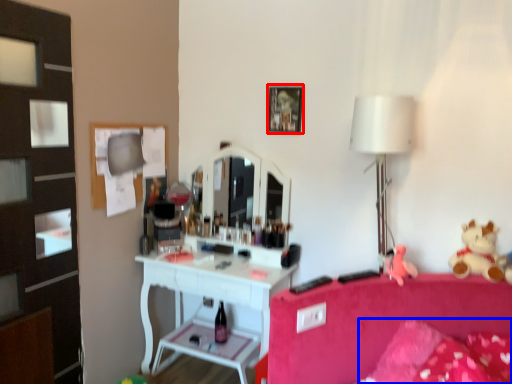
Question: Which object appears farthest to the camera in this image, picture frame (highlighted by a red box) or pillow (highlighted by a blue box)?

Choices:
 (A) picture frame
 (B) pillow

Answer: (A)